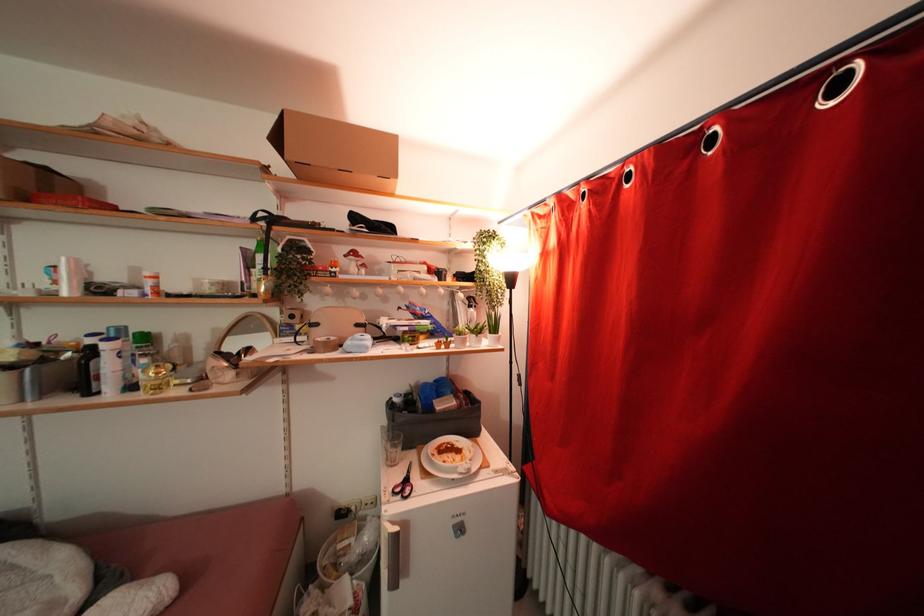
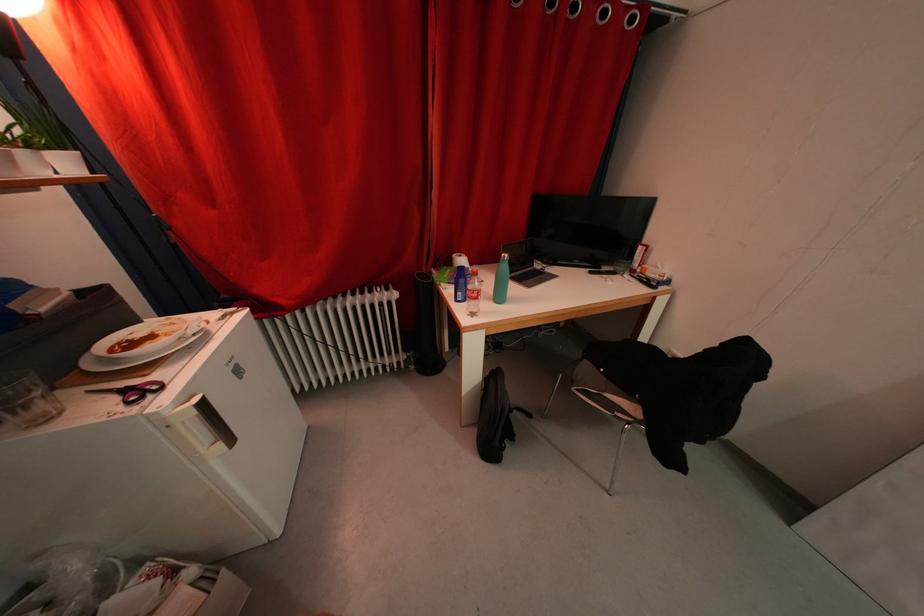
In the second image, find the point that corresponds to [645,572] in the first image.

(346, 302)